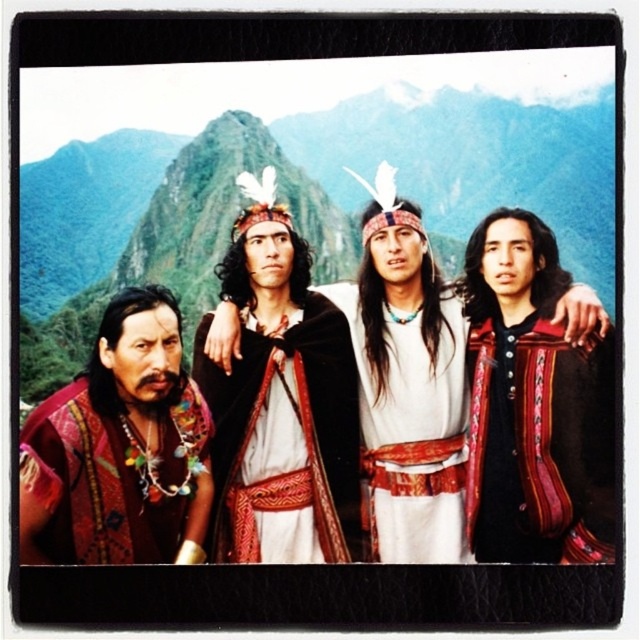
Which is more to the right, textured red fabric at left or black wool cape at center?

From the viewer's perspective, black wool cape at center appears more on the right side.

Can you confirm if textured red fabric at left is shorter than black wool cape at center?

No, textured red fabric at left is not shorter than black wool cape at center.

Identify the location of textured red fabric at left. The height and width of the screenshot is (640, 640). (120, 449).

Who is more distant from viewer, (161, 372) or (452, 365)?

The point (452, 365) is behind.

The width and height of the screenshot is (640, 640). I want to click on textured red fabric at left, so click(120, 449).

The image size is (640, 640). Describe the element at coordinates (291, 200) in the screenshot. I see `green grassy mountain at center` at that location.

Is green grassy mountain at center wider than black wool cape at center?

Yes, green grassy mountain at center is wider than black wool cape at center.

Locate an element on the screen. This screenshot has height=640, width=640. green grassy mountain at center is located at coordinates (291, 200).

Where is `green grassy mountain at center`? green grassy mountain at center is located at coordinates click(291, 200).